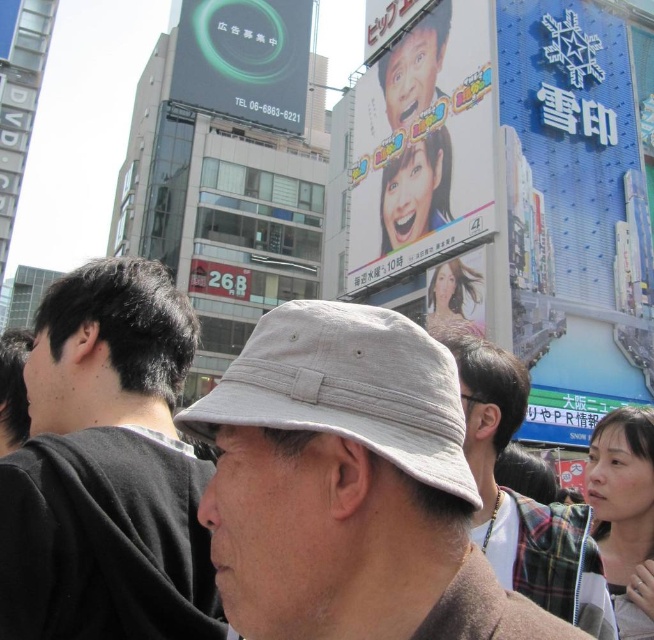
Which is below, light beige fabric baseball hat at center or matte red sign at center?

Positioned lower is light beige fabric baseball hat at center.

Looking at this image, is light beige fabric baseball hat at center below matte red sign at center?

Indeed, light beige fabric baseball hat at center is positioned under matte red sign at center.

Is point (336, 404) in front of point (226, 294)?

Yes, point (336, 404) is in front of point (226, 294).

Identify the location of light beige fabric baseball hat at center. click(347, 388).

Measure the distance from blue glossy sign at upper right to dark brown hair at left.

The distance of blue glossy sign at upper right from dark brown hair at left is 41.01 meters.

Is blue glossy sign at upper right wider than dark brown hair at left?

Yes, blue glossy sign at upper right is wider than dark brown hair at left.

Find the location of a particular element. blue glossy sign at upper right is located at coordinates (572, 161).

This screenshot has width=654, height=640. What are the coordinates of `blue glossy sign at upper right` in the screenshot? It's located at (572, 161).

Is green glossy billboard at upper left taller than matte red sign at center?

Correct, green glossy billboard at upper left is much taller as matte red sign at center.

Can you confirm if green glossy billboard at upper left is smaller than matte red sign at center?

Incorrect, green glossy billboard at upper left is not smaller in size than matte red sign at center.

Which is in front, point (241, 33) or point (190, 282)?

Positioned in front is point (190, 282).

The height and width of the screenshot is (640, 654). Find the location of `green glossy billboard at upper left`. green glossy billboard at upper left is located at coordinates (245, 60).